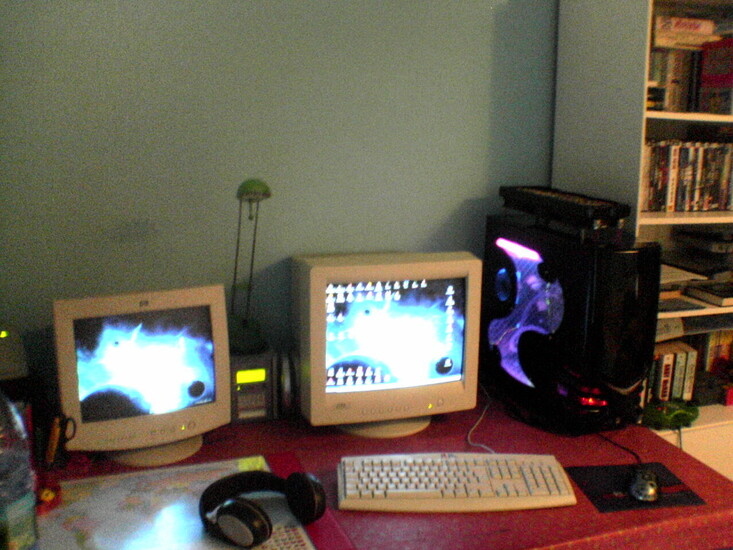
Locate an element on the screen. This screenshot has width=733, height=550. desktop lamp is located at coordinates (251, 191).